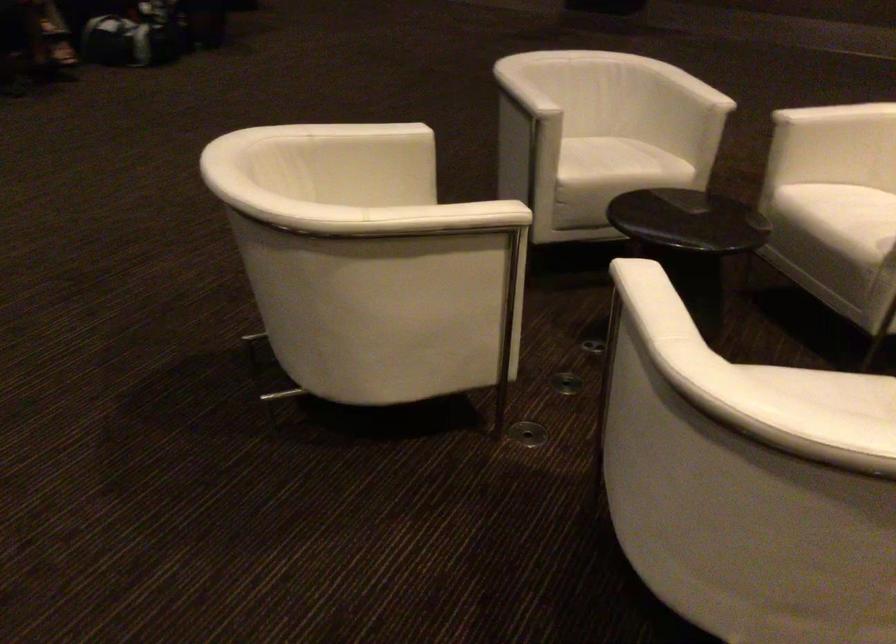
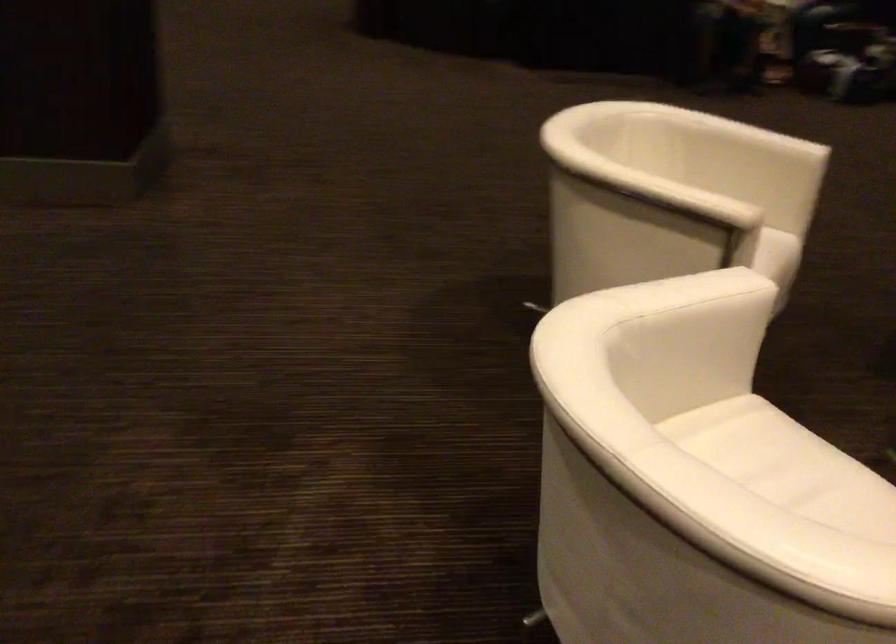
Locate, in the second image, the point that corresponds to the point at 476,279 in the first image.

(676, 261)